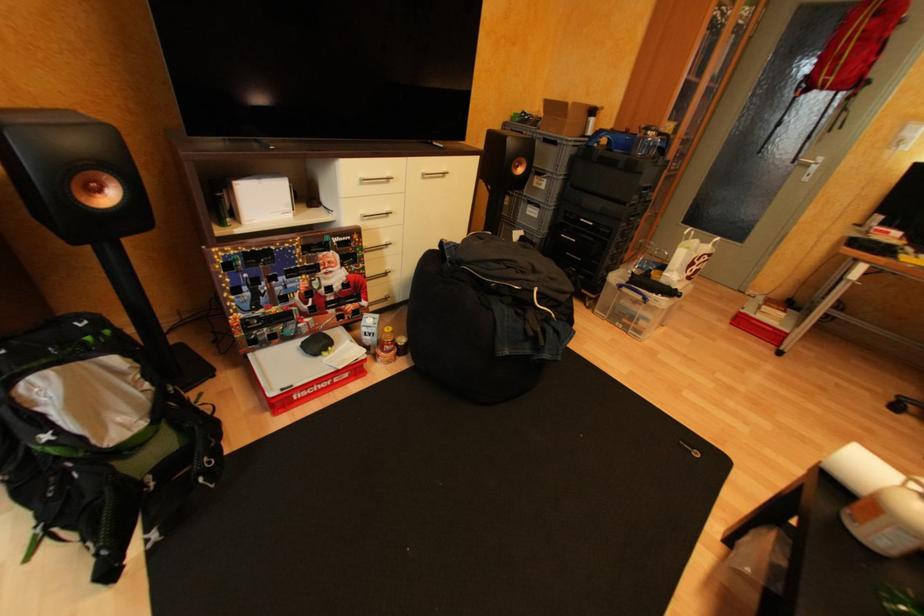
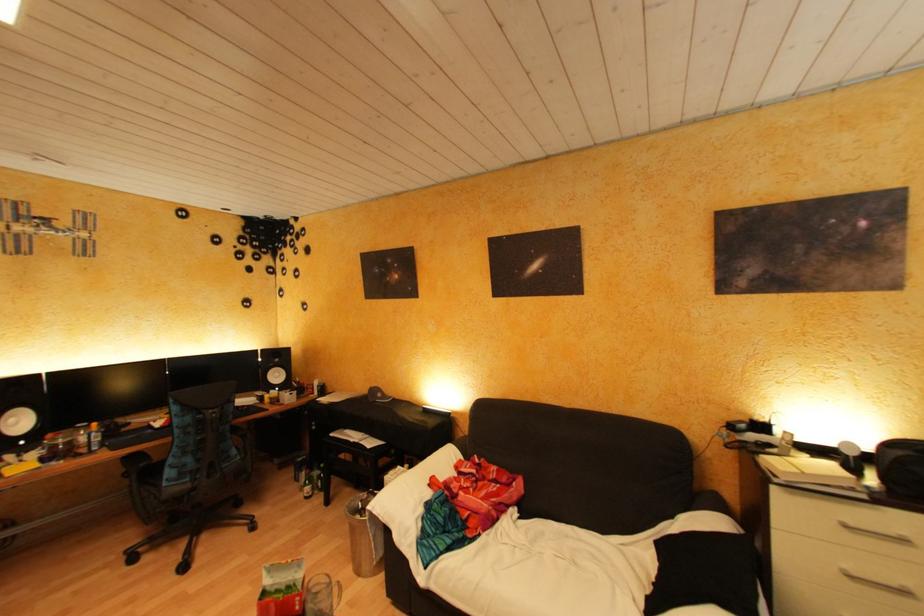
The images are taken continuously from a first-person perspective. In which direction is your viewpoint rotating?

The rotation direction of the camera is right-down.